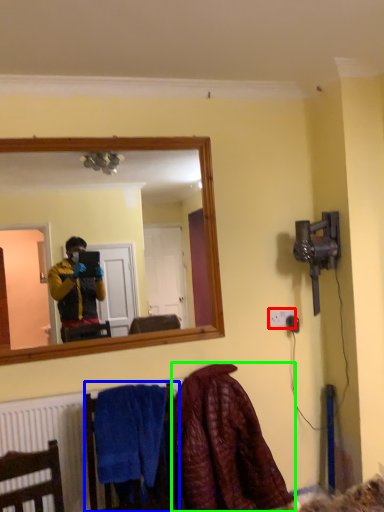
Question: Based on their relative distances, which object is nearer to electric outlet (highlighted by a red box)? Choose from armchair (highlighted by a blue box) and blanket (highlighted by a green box).

Choices:
 (A) armchair
 (B) blanket

Answer: (B)